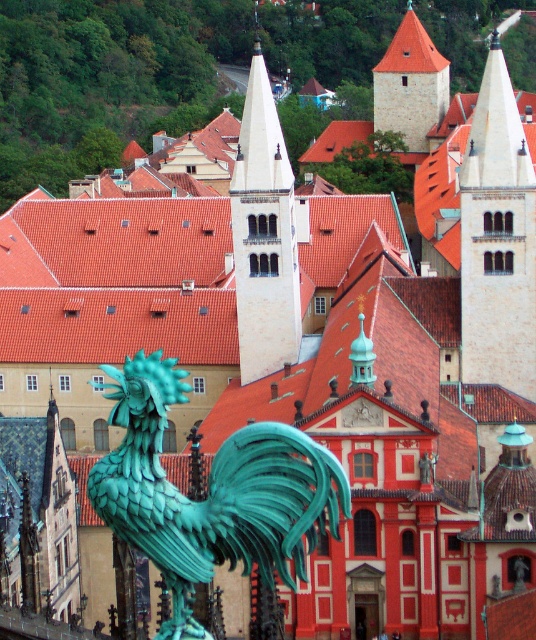
You are a tourist standing in the historic town square and want to take a photo of the green patina rooster at center. If the camera you are using has a focal length of 50mm and you are positioned at point 0.0, 0.0, can you estimate whether the rooster will be in the center of your photo?

The green patina rooster at center is located at point [211,492], which is not the exact center of the frame. Therefore, the rooster will appear slightly to the right and above the center of your photo.

You are standing at point (264, 234) in the historic European town. What can you see exactly at this location?

At point (264, 234) lies smooth beige tower at center.

You are an architect visiting the town and want to compare the two towers in the scene. Which tower is bigger in size between the smooth beige tower at center and the brown stone tower at upper center?

The smooth beige tower at center is larger in size than the brown stone tower at upper center.